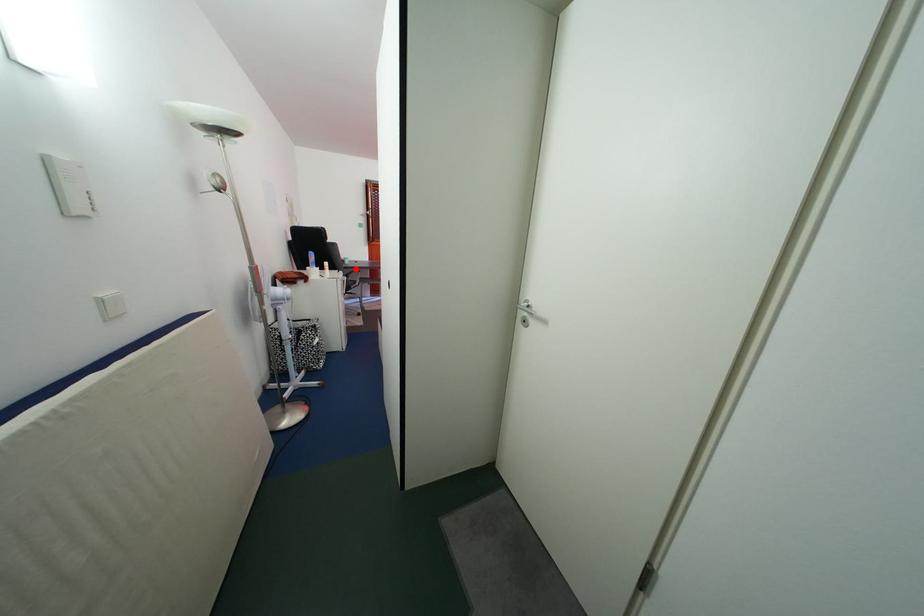
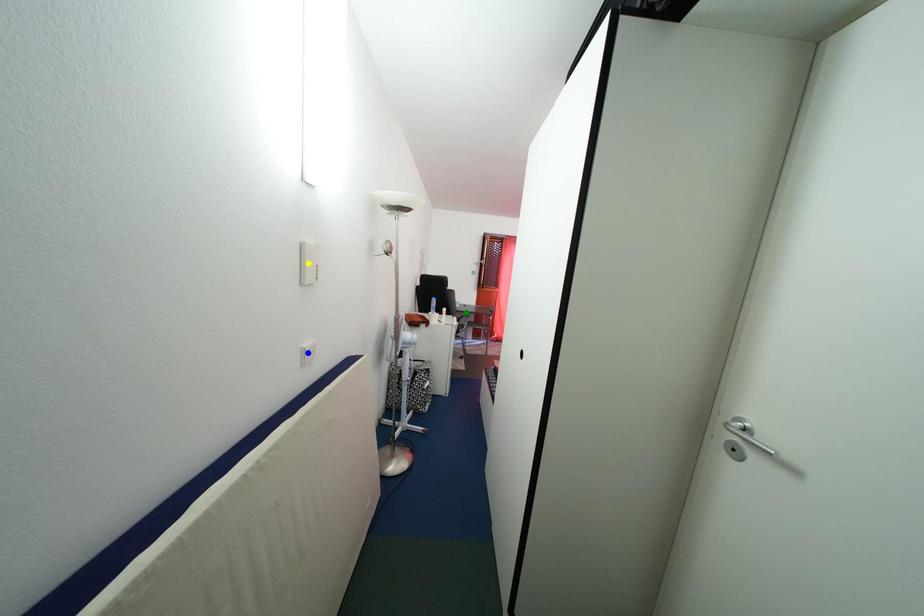
Question: I am providing you with two images of the same scene from different viewpoints. A red point is marked on the first image. You are given multiple points on the second image. Which mark in image 2 goes with the point in image 1?

Choices:
 (A) green point
 (B) yellow point
 (C) blue point

Answer: (A)